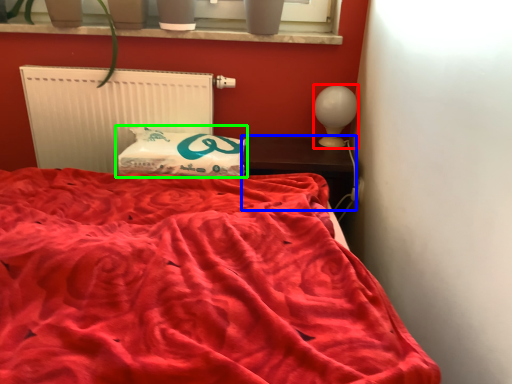
Question: Which object is the farthest from table lamp (highlighted by a red box)? Choose among these: furniture (highlighted by a blue box) or pillow (highlighted by a green box).

Choices:
 (A) furniture
 (B) pillow

Answer: (B)